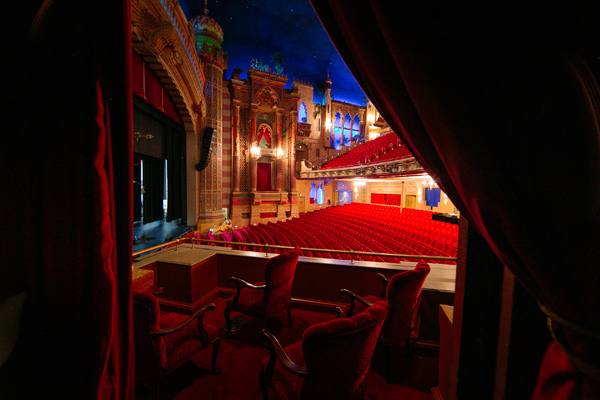
This screenshot has height=400, width=600. I want to click on stage, so click(162, 230).